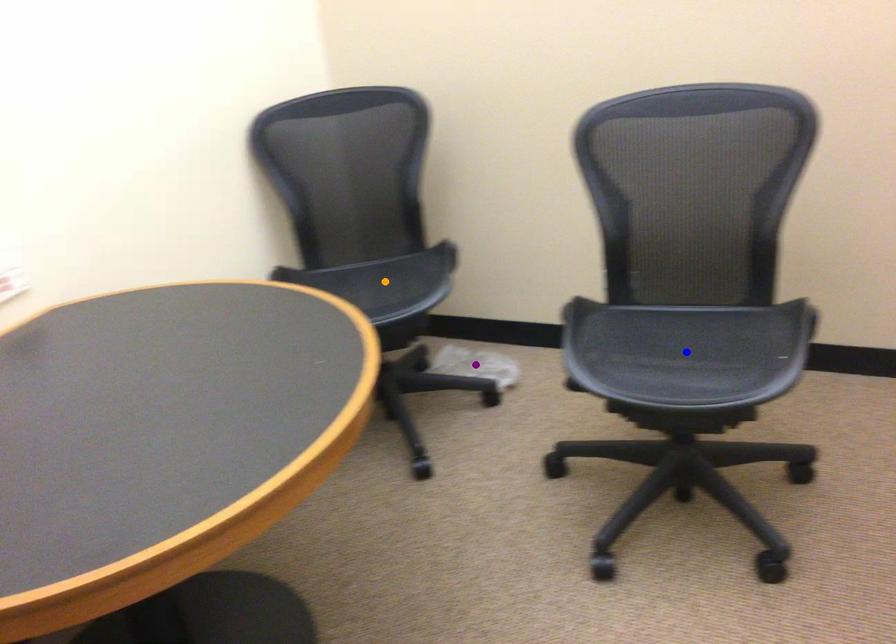
Order these from farthest to nearest:
orange point, blue point, purple point

purple point
orange point
blue point